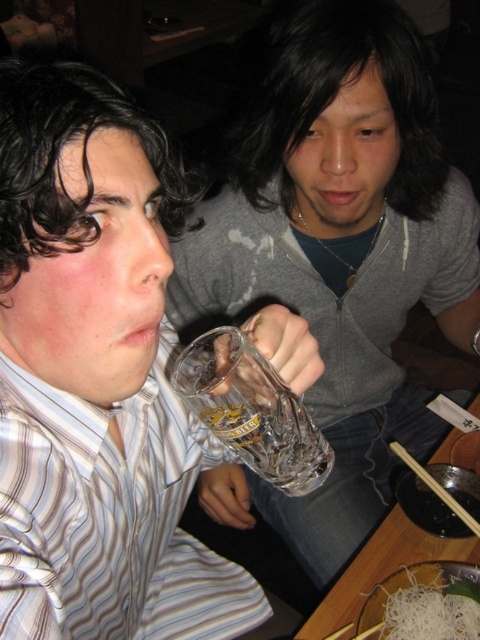
You are a waiter at a restaurant. You need to deliver a dessert to the table shown in the image. The dessert should be placed on the clear glass bowl at lower right. However, there is a clear glass beer at center in the way. To avoid spilling the beer, which object should you move first?

You should move the clear glass beer at center first because it is blocking the path to the clear glass bowl at lower right, which is where the dessert needs to be placed.

Consider the image. You are a waiter at this restaurant and need to deliver a dessert to the table. The dessert must be placed exactly at the point labeled as point (252, 410). However, there is a clear glass beer at center. Is there enough space to place the dessert there?

The point (252, 410) indicates the location of the clear glass beer at center, so placing the dessert there would require removing the beer first.